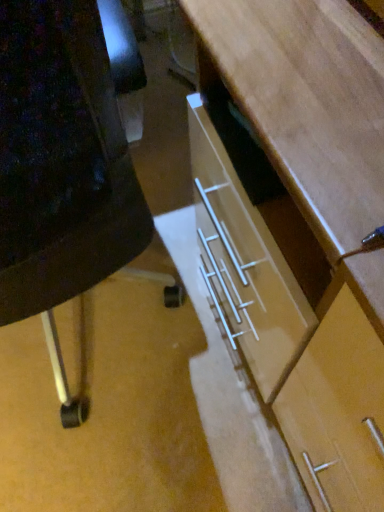
What do you see at coordinates (65, 161) in the screenshot? I see `white plastic drawer at lower center` at bounding box center [65, 161].

Find the location of a particular element. Image resolution: width=384 pixels, height=512 pixels. white plastic drawer at lower center is located at coordinates (65, 161).

Measure the distance between point [24,291] and camera.

Point [24,291] is 26.69 inches from camera.

The height and width of the screenshot is (512, 384). What do you see at coordinates (299, 224) in the screenshot? I see `wooden desk at center` at bounding box center [299, 224].

The width and height of the screenshot is (384, 512). I want to click on wooden desk at center, so click(x=299, y=224).

Find the location of a particular element. white plastic drawer at lower center is located at coordinates (65, 161).

Which is more to the left, wooden desk at center or white plastic drawer at lower center?

white plastic drawer at lower center is more to the left.

Considering the positions of objects wooden desk at center and white plastic drawer at lower center in the image provided, who is behind, wooden desk at center or white plastic drawer at lower center?

wooden desk at center.

From the picture: Which is farther, (365, 220) or (28, 187)?

The point (28, 187) is behind.

From the image's perspective, is wooden desk at center above white plastic drawer at lower center?

Indeed, from the image's perspective, wooden desk at center is shown above white plastic drawer at lower center.

From a real-world perspective, is wooden desk at center positioned under white plastic drawer at lower center based on gravity?

Yes, from a real-world perspective, wooden desk at center is beneath white plastic drawer at lower center.

Which object is wider, wooden desk at center or white plastic drawer at lower center?

Wider between the two is wooden desk at center.

Which of these two, wooden desk at center or white plastic drawer at lower center, stands shorter?

wooden desk at center.

Who is smaller, wooden desk at center or white plastic drawer at lower center?

With smaller size is wooden desk at center.

Is wooden desk at center not inside white plastic drawer at lower center?

Yes, wooden desk at center is not within white plastic drawer at lower center.

Is wooden desk at center far from white plastic drawer at lower center?

wooden desk at center is actually quite close to white plastic drawer at lower center.

Is wooden desk at center facing away from white plastic drawer at lower center?

No, white plastic drawer at lower center is not at the back of wooden desk at center.

The height and width of the screenshot is (512, 384). I want to click on desk that is under the white plastic drawer at lower center (from a real-world perspective), so click(x=299, y=224).

Between white plastic drawer at lower center and wooden desk at center, which one appears on the right side from the viewer's perspective?

From the viewer's perspective, wooden desk at center appears more on the right side.

Is white plastic drawer at lower center in front of or behind wooden desk at center in the image?

In the image, white plastic drawer at lower center appears in front of wooden desk at center.

Which point is more forward, (x=109, y=97) or (x=199, y=65)?

Point (x=109, y=97)

From the image's perspective, is white plastic drawer at lower center located beneath wooden desk at center?

Indeed, from the image's perspective, white plastic drawer at lower center is shown beneath wooden desk at center.

From a real-world perspective, which is physically above, white plastic drawer at lower center or wooden desk at center?

white plastic drawer at lower center, from a real-world perspective.

Looking at this image, in terms of width, does white plastic drawer at lower center look wider or thinner when compared to wooden desk at center?

In the image, white plastic drawer at lower center appears to be more narrow than wooden desk at center.

Is white plastic drawer at lower center taller than wooden desk at center?

Indeed, white plastic drawer at lower center has a greater height compared to wooden desk at center.

In terms of size, does white plastic drawer at lower center appear bigger or smaller than wooden desk at center?

→ white plastic drawer at lower center is bigger than wooden desk at center.

Choose the correct answer: Is white plastic drawer at lower center inside wooden desk at center or outside it?

white plastic drawer at lower center is spatially situated outside wooden desk at center.

In the scene shown: Is white plastic drawer at lower center not near wooden desk at center?

Actually, white plastic drawer at lower center and wooden desk at center are a little close together.

Is white plastic drawer at lower center positioned with its back to wooden desk at center?

No, white plastic drawer at lower center's orientation is not away from wooden desk at center.

Can you tell me how much white plastic drawer at lower center and wooden desk at center differ in facing direction?

The angle between the facing direction of white plastic drawer at lower center and the facing direction of wooden desk at center is 1.95 degrees.

The height and width of the screenshot is (512, 384). There is a wooden desk at center. In order to click on furniture above it (from a real-world perspective) in this screenshot , I will do `click(65, 161)`.

You are a GUI agent. You are given a task and a screenshot of the screen. Output one action in this format:
    pyautogui.click(x=<x>, y=<y>)
    Task: Click on the desk that is under the white plastic drawer at lower center (from a real-world perspective)
    The width and height of the screenshot is (384, 512).
    Given the screenshot: What is the action you would take?
    pyautogui.click(x=299, y=224)

Find the location of a particular element. The width and height of the screenshot is (384, 512). furniture located above the wooden desk at center (from a real-world perspective) is located at coordinates (65, 161).